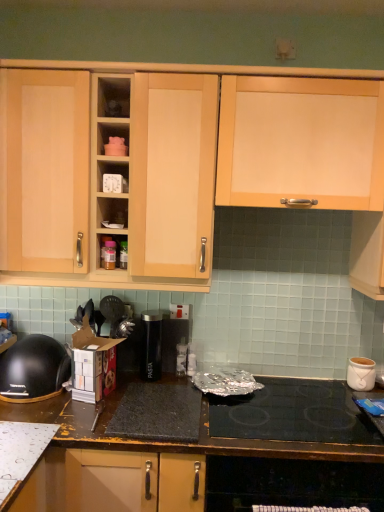
Question: From a real-world perspective, is dark brown laminate countertop at lower center above or below black glass cooktop at lower center?

Choices:
 (A) below
 (B) above

Answer: (A)

Question: From the image's perspective, is dark brown laminate countertop at lower center above or below black glass cooktop at lower center?

Choices:
 (A) above
 (B) below

Answer: (B)

Question: Which object is positioned closest to the white ceramic pot at right?

Choices:
 (A) dark brown laminate countertop at lower center
 (B) black plastic container at center, which ranks as the first appliance in back-to-front order
 (C) black plastic bowl at lower left
 (D) black glass cooktop at lower center
 (E) matte plastic shelf at center, the first shelf viewed from the top

Answer: (D)

Question: Estimate the real-world distances between objects in this image. Which object is farther from the black glass cooktop at lower center?

Choices:
 (A) black plastic bowl at lower left
 (B) light wood cabinet at upper right, which ranks as the 2th cabinetry in left-to-right order
 (C) black plastic container at center, arranged as the second appliance when viewed from the front
 (D) light wood cabinet at upper left, the 2th cabinetry in the right-to-left sequence
 (E) white ceramic pot at right

Answer: (B)